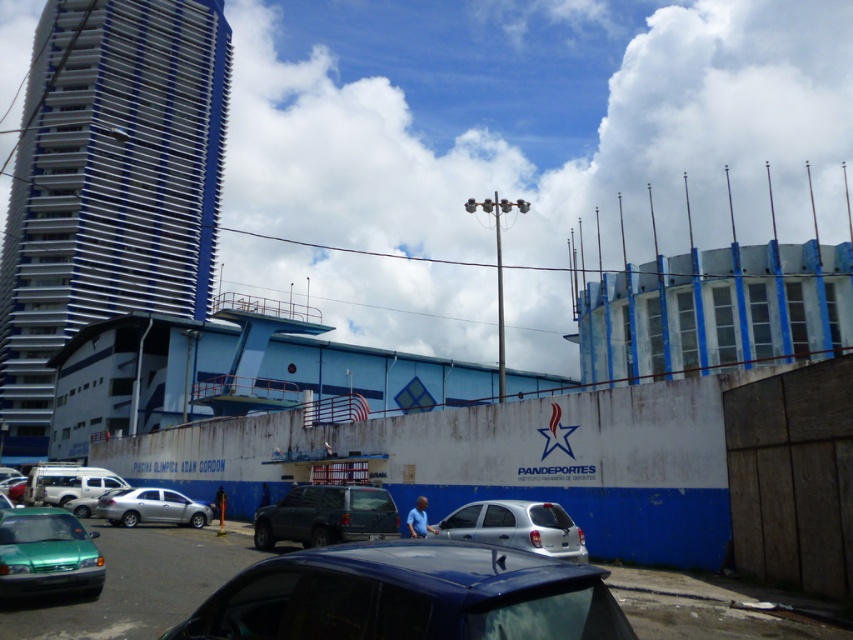
This screenshot has height=640, width=853. What do you see at coordinates (108, 186) in the screenshot? I see `blue glass tower at left` at bounding box center [108, 186].

Is the position of blue glass tower at left more distant than that of silver metallic car at center?

Yes.

Who is more forward, (131, 28) or (548, 524)?

Point (548, 524)

Identify the location of blue glass tower at left. This screenshot has width=853, height=640. (108, 186).

Is green matte car at lower left positioned at the back of silver metallic car at lower left?

That is False.

Can you confirm if green matte car at lower left is taller than silver metallic car at lower left?

Yes.

Is point (33, 579) less distant than point (112, 492)?

Yes, point (33, 579) is in front of point (112, 492).

Where is `green matte car at lower left`? This screenshot has height=640, width=853. green matte car at lower left is located at coordinates (47, 554).

The image size is (853, 640). What do you see at coordinates (409, 596) in the screenshot? I see `glossy blue car at center` at bounding box center [409, 596].

In the scene shown: Who is positioned more to the left, glossy blue car at center or satin silver sedan at center?

Positioned to the left is satin silver sedan at center.

This screenshot has width=853, height=640. What do you see at coordinates (409, 596) in the screenshot?
I see `glossy blue car at center` at bounding box center [409, 596].

Where is `glossy blue car at center`? Image resolution: width=853 pixels, height=640 pixels. glossy blue car at center is located at coordinates (409, 596).